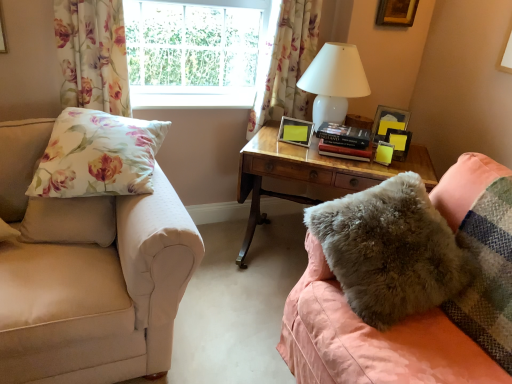
Identify the location of space that is in front of yellow matte picture frame at upper right, which is the 4th picture frame from top to bottom. The width and height of the screenshot is (512, 384). (386, 164).